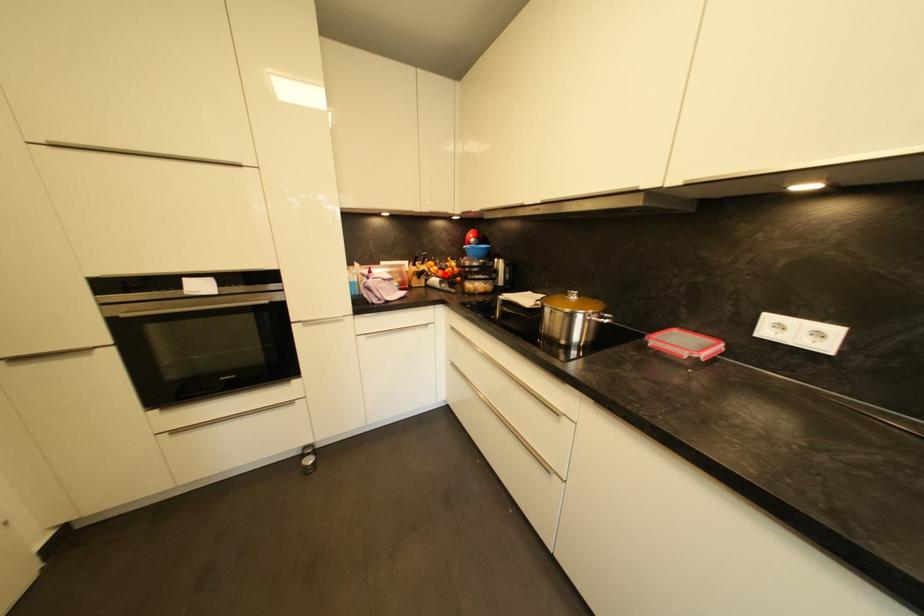
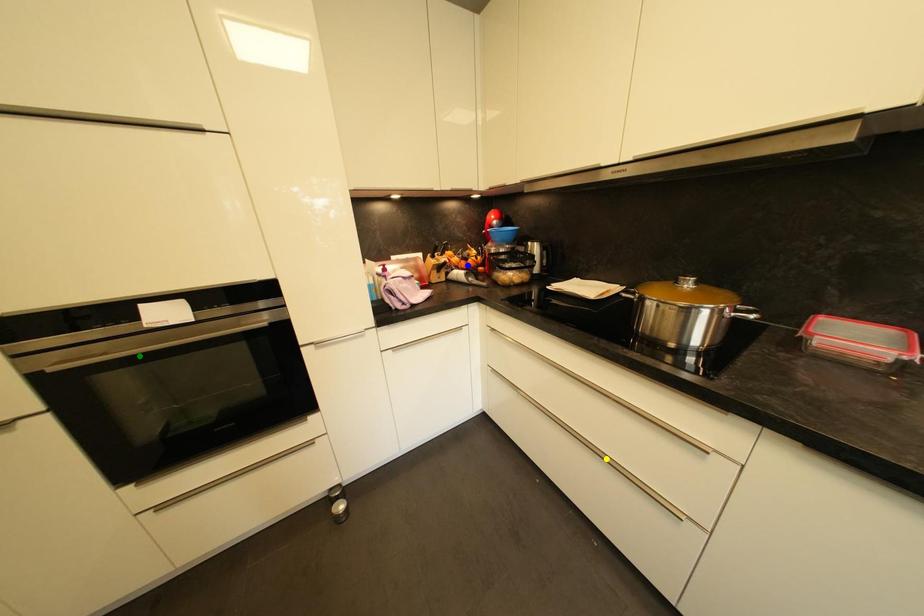
Question: I am providing you with two images of the same scene from different viewpoints. A red point is marked on the first image. You are given multiple points on the second image. Can you choose the point in image 2 that corresponds to the point in image 1?

Choices:
 (A) green point
 (B) blue point
 (C) yellow point

Answer: (B)